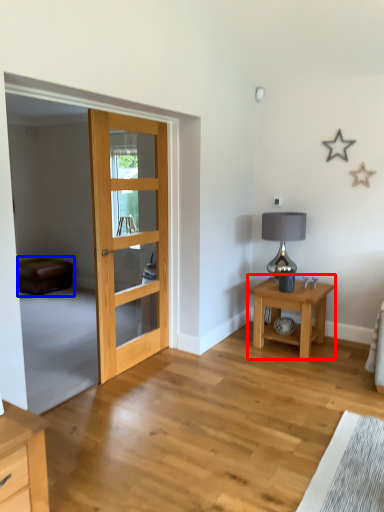
Question: Which of the following is the farthest to the observer, nightstand (highlighted by a red box) or couch (highlighted by a blue box)?

Choices:
 (A) nightstand
 (B) couch

Answer: (B)